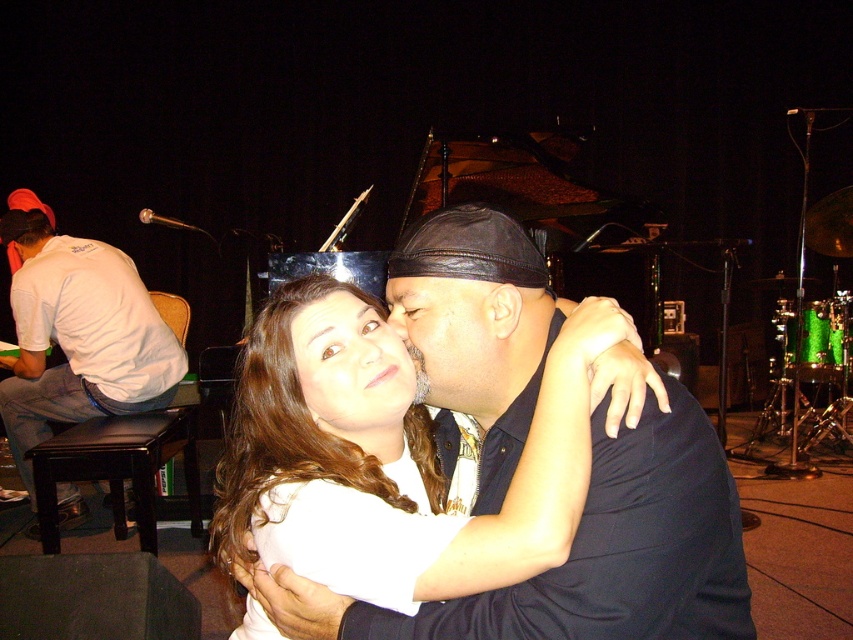
Question: Estimate the real-world distances between objects in this image. Which object is closer to the dark blue shirt at center?

Choices:
 (A) dark brown leather stool at lower left
 (B) white t-shirt at left
 (C) matte white face at center

Answer: (C)

Question: Based on their relative distances, which object is farther from the dark brown leather stool at lower left?

Choices:
 (A) matte white face at center
 (B) dark blue shirt at center
 (C) matte black hat at center
 (D) white t-shirt at left

Answer: (C)

Question: Is matte white face at center to the left of dark brown leather stool at lower left from the viewer's perspective?

Choices:
 (A) yes
 (B) no

Answer: (B)

Question: Does dark blue shirt at center have a smaller size compared to matte white face at center?

Choices:
 (A) no
 (B) yes

Answer: (A)

Question: Which point is closer to the camera taking this photo?

Choices:
 (A) (432, 400)
 (B) (44, 540)

Answer: (A)

Question: Can you confirm if matte white face at center is thinner than matte black hat at center?

Choices:
 (A) yes
 (B) no

Answer: (A)